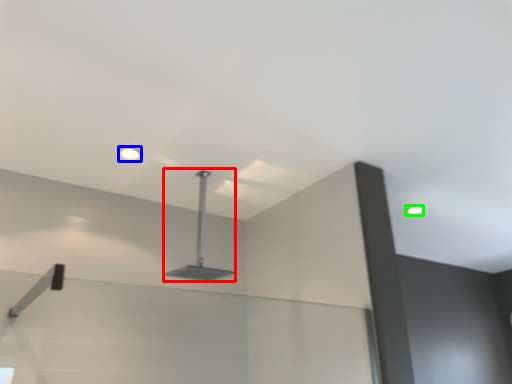
Question: Which object is positioned farthest from lamp (highlighted by a red box)? Select from droplight (highlighted by a blue box) and droplight (highlighted by a green box).

Choices:
 (A) droplight
 (B) droplight

Answer: (B)